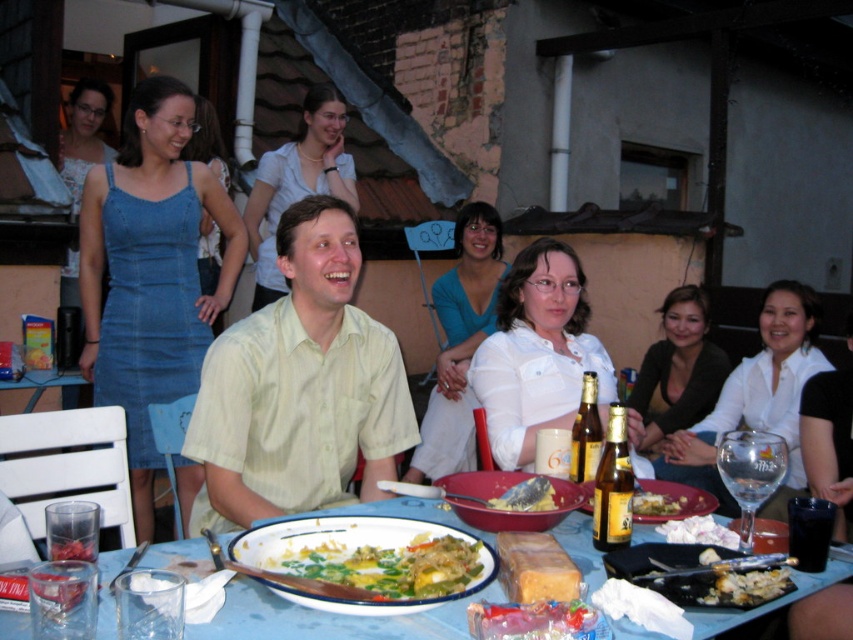
You are a guest at the gathering and want to describe your outfit to another attendee. Which item is taller between the white glossy shirt at upper center and the green leafy vegetables at center?

The white glossy shirt at upper center is taller than the green leafy vegetables at center.

You are at the table and want to reach for the crumbly bread at lower right without moving the matte white blouse at center. Is this possible?

The crumbly bread at lower right is behind the matte white blouse at center, so you can reach it without moving the blouse.